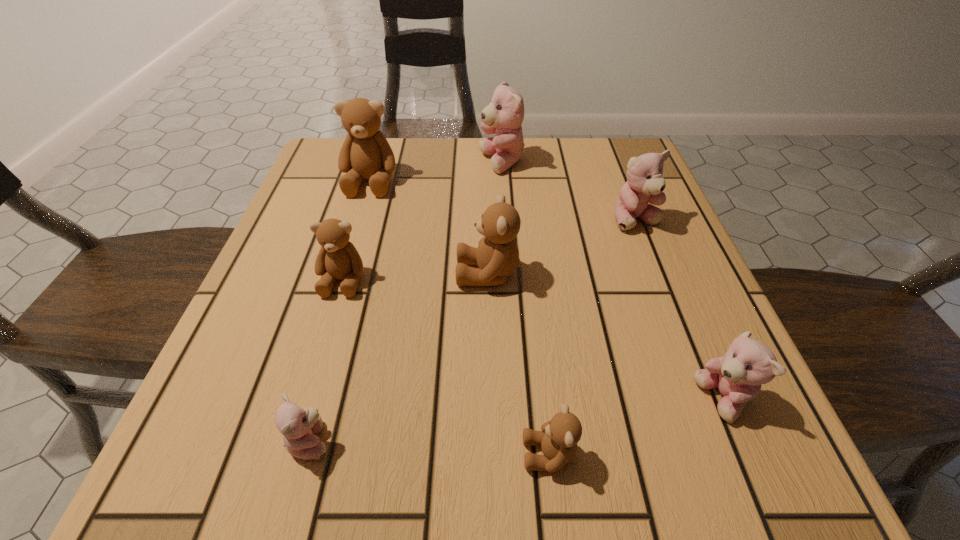
Choose which brown teddy bear is the third nearest neighbor to the nearest brown teddy bear. Please provide its 2D coordinates. Your answer should be formatted as a tuple, i.e. [(x, y)], where the tuple contains the x and y coordinates of a point satisfying the conditions above.

[(365, 153)]

The height and width of the screenshot is (540, 960). Find the location of `brown teddy bear that stands as the third closest to the third biggest pink teddy bear`. brown teddy bear that stands as the third closest to the third biggest pink teddy bear is located at coordinates (338, 258).

Where is `vacant area in the image that satisfies the following two spatial constraints: 1. at the face of the third smallest pink teddy bear; 2. on the front-facing side of the smallest brown teddy bear`? vacant area in the image that satisfies the following two spatial constraints: 1. at the face of the third smallest pink teddy bear; 2. on the front-facing side of the smallest brown teddy bear is located at coordinates (728, 454).

Locate an element on the screen. The height and width of the screenshot is (540, 960). vacant area in the image that satisfies the following two spatial constraints: 1. at the face of the third farthest teddy bear; 2. on the front-facing side of the smallest brown teddy bear is located at coordinates (728, 454).

You are a GUI agent. You are given a task and a screenshot of the screen. Output one action in this format:
    pyautogui.click(x=<x>, y=<y>)
    Task: Click on the vacant point that satisfies the following two spatial constraints: 1. on the front-facing side of the third smallest brown teddy bear; 2. on the front-facing side of the second smallest brown teddy bear
    This screenshot has width=960, height=540.
    Given the screenshot: What is the action you would take?
    (488, 280)